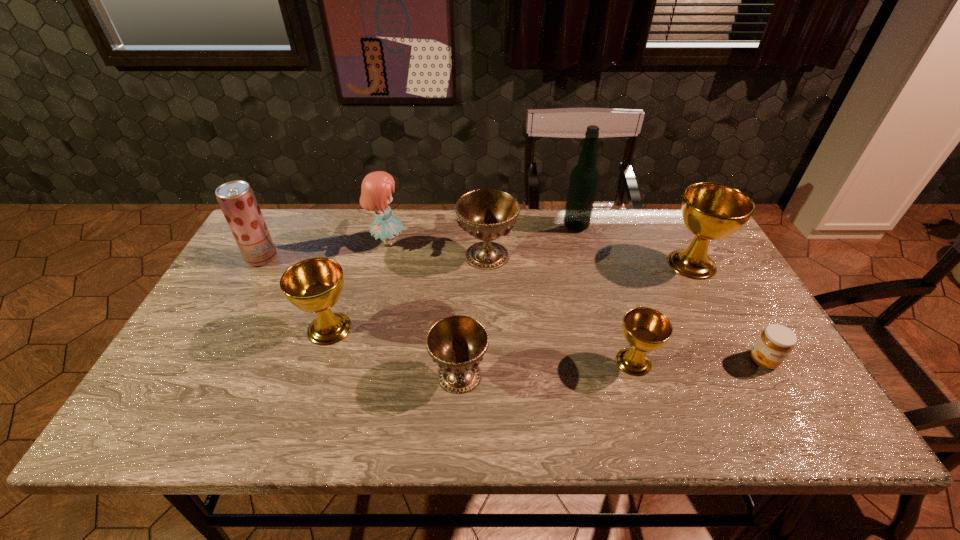
This screenshot has width=960, height=540. I want to click on free area in between the blue doll and the orange jam, so click(x=576, y=301).

Where is `vacant space in between the blue doll and the fruit juice`? The height and width of the screenshot is (540, 960). vacant space in between the blue doll and the fruit juice is located at coordinates (324, 250).

You are a GUI agent. You are given a task and a screenshot of the screen. Output one action in this format:
    pyautogui.click(x=<x>, y=<y>)
    Task: Click on the empty location between the doll and the bigger red chalice
    The height and width of the screenshot is (540, 960).
    Given the screenshot: What is the action you would take?
    pyautogui.click(x=438, y=249)

Identify the location of free space between the bigger red chalice and the blue doll. (438, 249).

Locate an element on the screen. The width and height of the screenshot is (960, 540). empty space between the smaller red chalice and the strawberry fruit juice is located at coordinates click(x=361, y=316).

You are a GUI agent. You are given a task and a screenshot of the screen. Output one action in this format:
    pyautogui.click(x=<x>, y=<y>)
    Task: Click on the vacant space that's between the second gold chalice from right to left and the blue doll
    The height and width of the screenshot is (540, 960).
    Given the screenshot: What is the action you would take?
    pyautogui.click(x=511, y=302)

Find the location of a particular element. The height and width of the screenshot is (540, 960). vacant point located between the alcohol and the biggest gold chalice is located at coordinates (634, 245).

The height and width of the screenshot is (540, 960). Identify the location of vacant space in between the tallest object and the fruit juice. (419, 242).

The image size is (960, 540). I want to click on empty location between the leftmost gold chalice and the farther red chalice, so click(x=408, y=292).

Where is `object identified as the fifth closest to the second smallest gold chalice`? Image resolution: width=960 pixels, height=540 pixels. object identified as the fifth closest to the second smallest gold chalice is located at coordinates (645, 329).